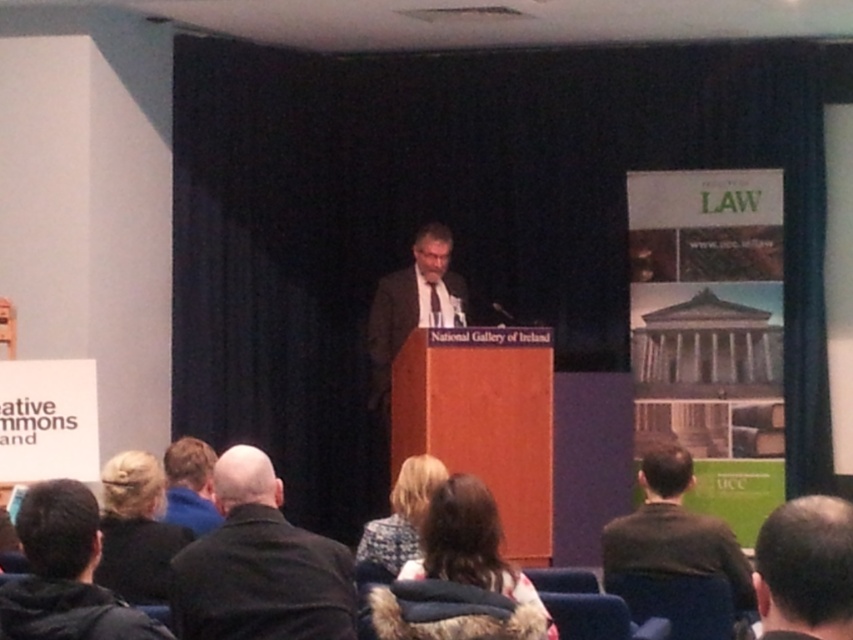
You are an event organizer who needs to determine seating arrangements. You notice two attendees in the front row, one with blonde hair at lower left and another wearing a dark suit at center. Which attendee has a narrower profile when viewed from the front?

The blonde hair at lower left has a thinner profile than the dark suit at center when viewed from the front, so the attendee with blonde hair at lower left has a narrower profile.